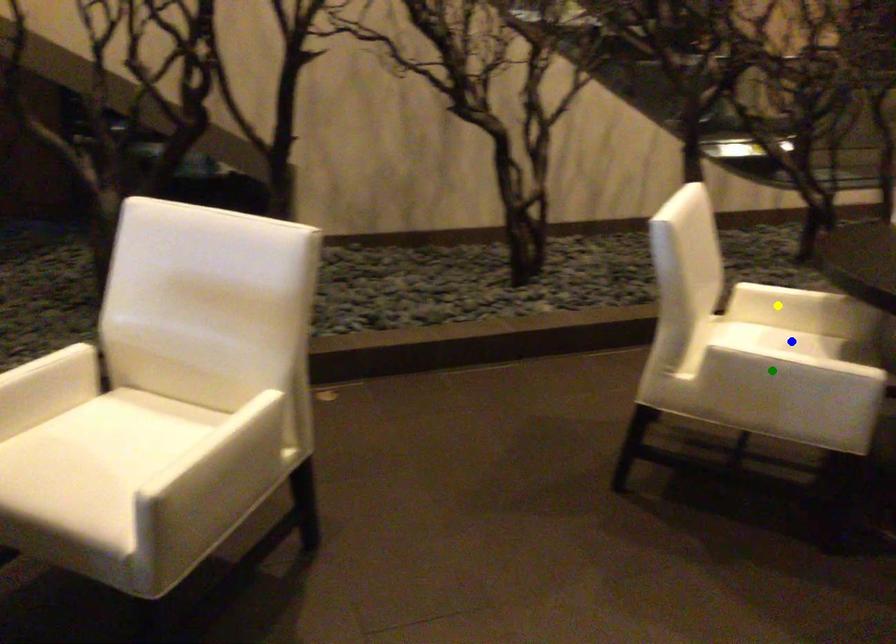
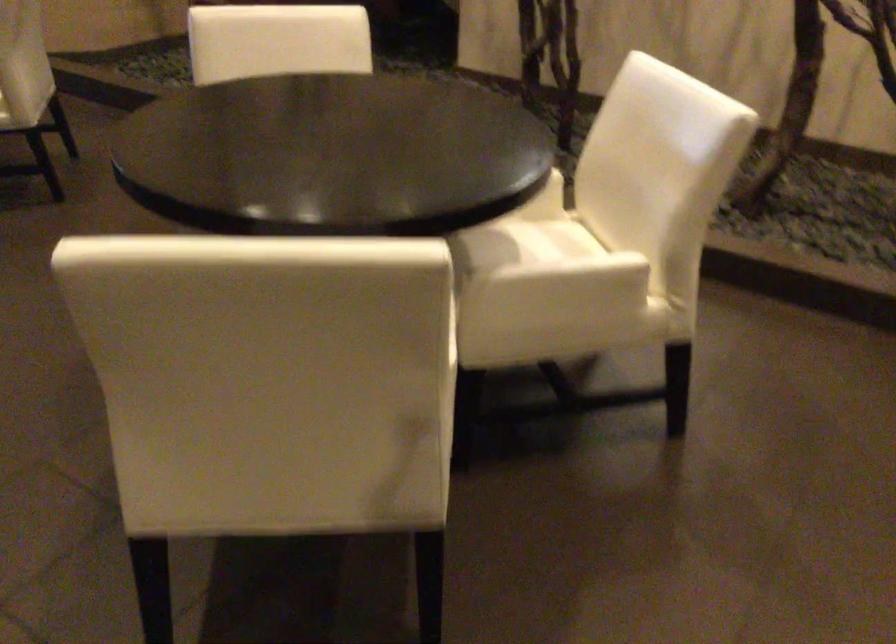
I am providing you with two images of the same scene from different viewpoints. Three points are marked in image1. Which point corresponds to a part or object that is occluded in image2?In image1, three points are marked. Which of them correspond to a part or object that is occluded in image2?Among the three points shown in image1, which one corresponds to a part or object that is no longer visible due to occlusion in image2?

blue point, green point, yellow point cannot be seen in image2.